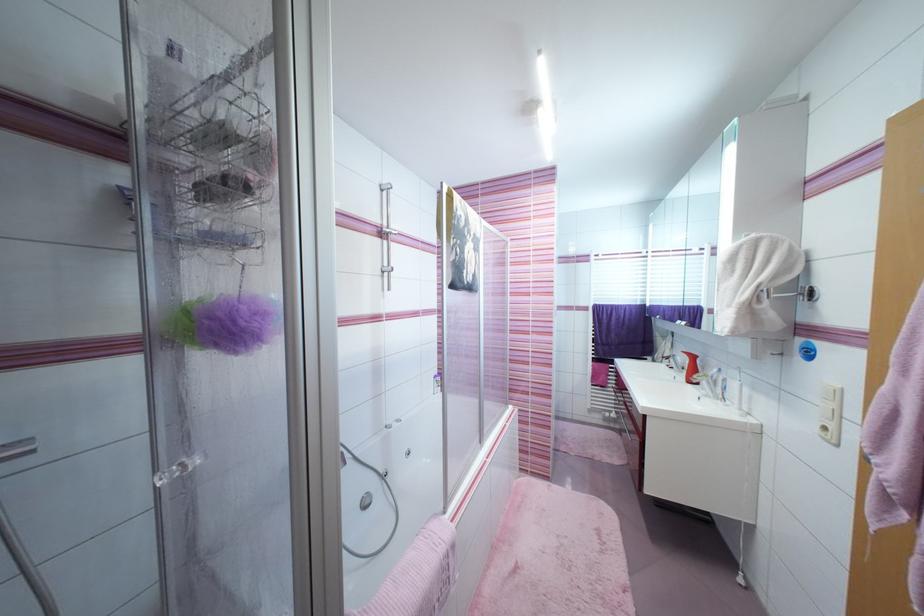
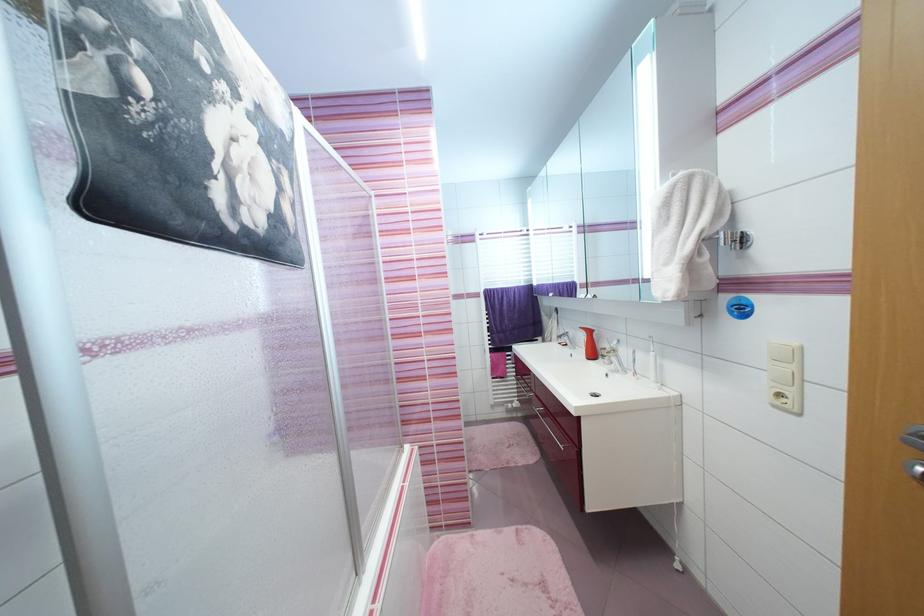
Question: Which direction would the cameraman need to move to produce the second image? Reply with the corresponding letter.

Choices:
 (A) Left
 (B) Right
 (C) Forward
 (D) Backward

Answer: (C)